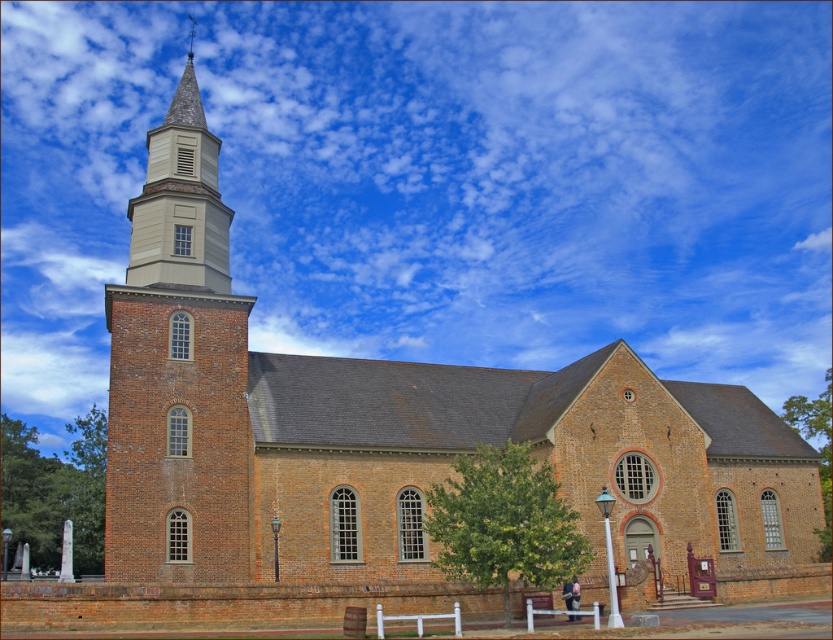
Question: Does brick steeple at left appear on the left side of light beige wood bell tower at upper center?

Choices:
 (A) yes
 (B) no

Answer: (B)

Question: Which object is farther from the camera taking this photo?

Choices:
 (A) brick steeple at left
 (B) light beige wood bell tower at upper center

Answer: (B)

Question: Is brick steeple at left to the right of light beige wood bell tower at upper center from the viewer's perspective?

Choices:
 (A) yes
 (B) no

Answer: (A)

Question: Is brick steeple at left positioned at the back of light beige wood bell tower at upper center?

Choices:
 (A) yes
 (B) no

Answer: (B)